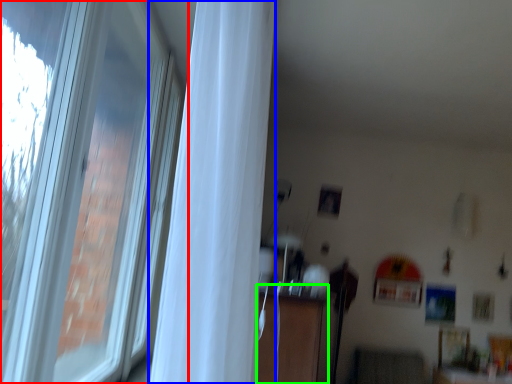
Question: Based on their relative distances, which object is farther from window (highlighted by a red box)? Choose from curtain (highlighted by a blue box) and dresser (highlighted by a green box).

Choices:
 (A) curtain
 (B) dresser

Answer: (A)